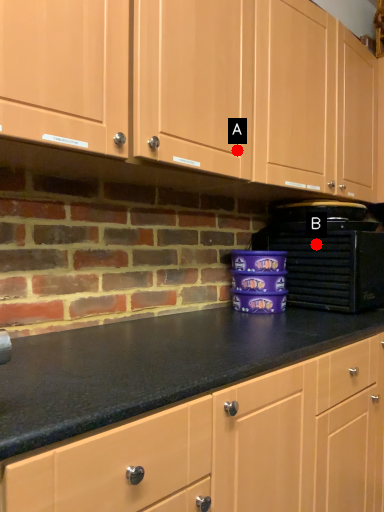
Question: Two points are circled on the image, labeled by A and B beside each circle. Among these points, which one is nearest to the camera?

Choices:
 (A) A is closer
 (B) B is closer

Answer: (A)